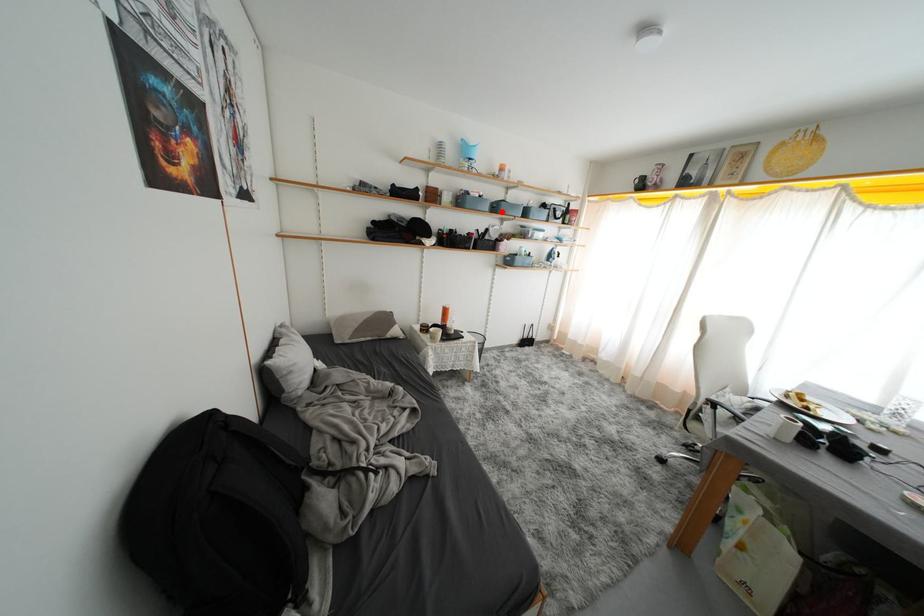
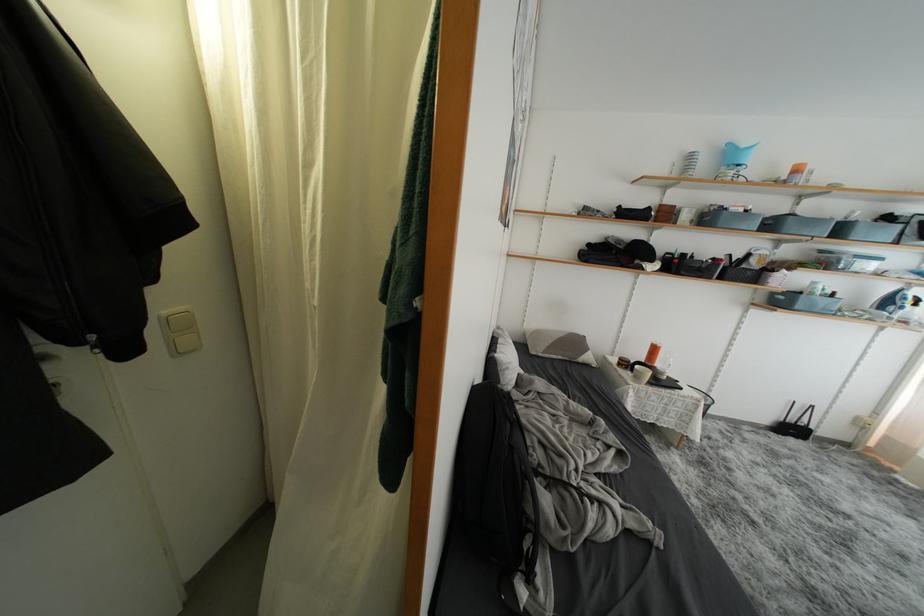
In the second image, find the point that corresponds to the highlighted location in the first image.

(777, 229)